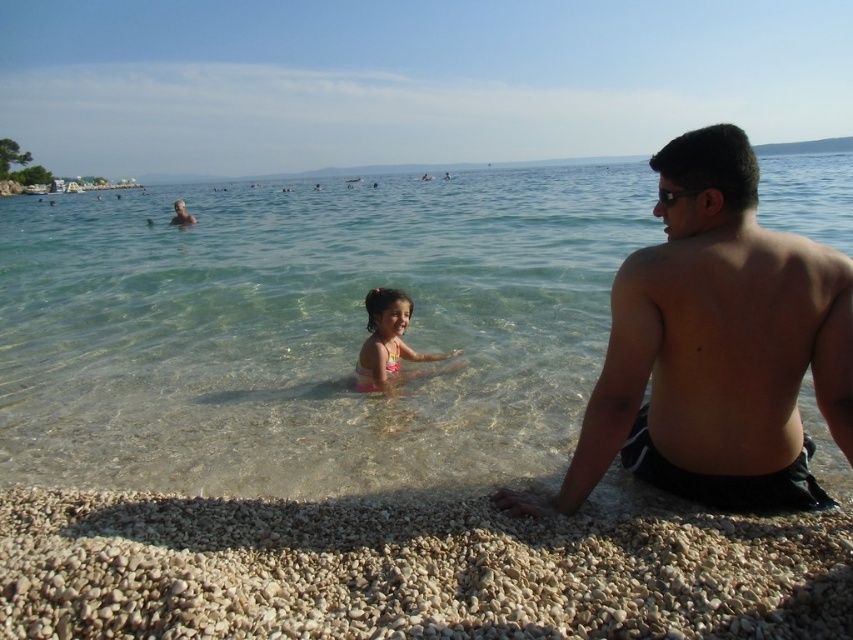
Question: Can you confirm if smooth pebble beach at lower center is smaller than smooth skin man at upper left?

Choices:
 (A) yes
 (B) no

Answer: (A)

Question: Can you confirm if smooth pebble beach at lower center is wider than pink fabric swimsuit at center?

Choices:
 (A) no
 (B) yes

Answer: (B)

Question: Which point is closer to the camera?

Choices:
 (A) pink fabric swimsuit at center
 (B) smooth skin man at upper left
 (C) shiny black skin at lower right
 (D) smooth pebble beach at lower center

Answer: (D)

Question: From the image, what is the correct spatial relationship of shiny black skin at lower right in relation to pink fabric swimsuit at center?

Choices:
 (A) left
 (B) right

Answer: (B)

Question: Estimate the real-world distances between objects in this image. Which object is farther from the smooth skin man at upper left?

Choices:
 (A) pink fabric swimsuit at center
 (B) clear water at center
 (C) shiny black skin at lower right

Answer: (C)

Question: Among these points, which one is farthest from the camera?

Choices:
 (A) (6, 632)
 (B) (86, 317)

Answer: (B)